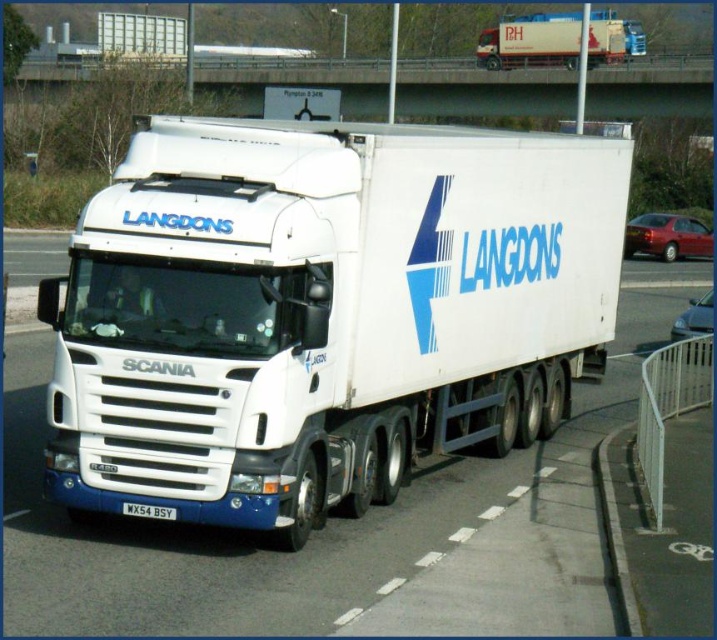
Who is taller, brushed metal bridge at upper center or black plastic license plate at center?

brushed metal bridge at upper center

Is brushed metal bridge at upper center thinner than black plastic license plate at center?

In fact, brushed metal bridge at upper center might be wider than black plastic license plate at center.

Is point (528, 77) positioned before point (128, 515)?

No.

Locate an element on the screen. This screenshot has width=717, height=640. brushed metal bridge at upper center is located at coordinates (483, 90).

Between point (184, 244) and point (171, 513), which one is positioned behind?

The point (171, 513) is behind.

Is point (315, 284) closer to viewer compared to point (174, 513)?

No, (315, 284) is further to viewer.

Is point (508, 275) farther from camera compared to point (146, 504)?

Yes, it is.

The image size is (717, 640). I want to click on white matte trailer truck at center, so click(323, 310).

Does white matte trailer truck at center appear under white matte truck at upper center?

Yes.

Is point (353, 384) behind point (627, 54)?

No.

Locate an element on the screen. This screenshot has height=640, width=717. white matte trailer truck at center is located at coordinates (323, 310).